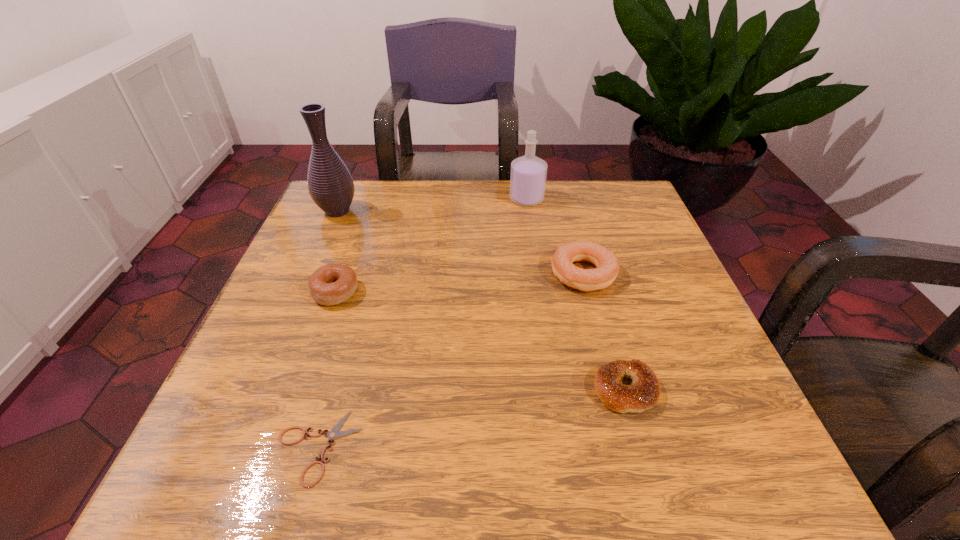
You are a GUI agent. You are given a task and a screenshot of the screen. Output one action in this format:
    pyautogui.click(x=<x>, y=<y>)
    Task: Click on the free region that satisfies the following two spatial constraints: 1. on the front side of the leftmost bagel; 2. on the left side of the tallest object
    Image resolution: width=960 pixels, height=540 pixels.
    Given the screenshot: What is the action you would take?
    pyautogui.click(x=302, y=292)